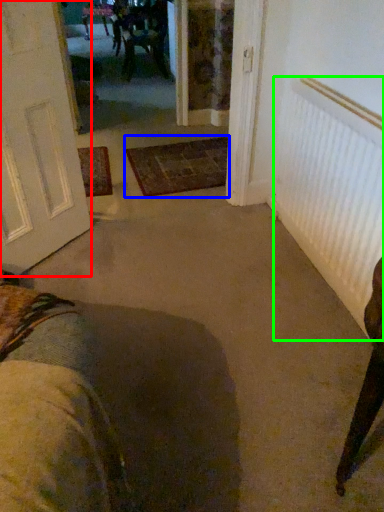
Question: Considering the real-world distances, which object is closest to door (highlighted by a red box)? doormat (highlighted by a blue box) or radiator (highlighted by a green box).

Choices:
 (A) doormat
 (B) radiator

Answer: (A)